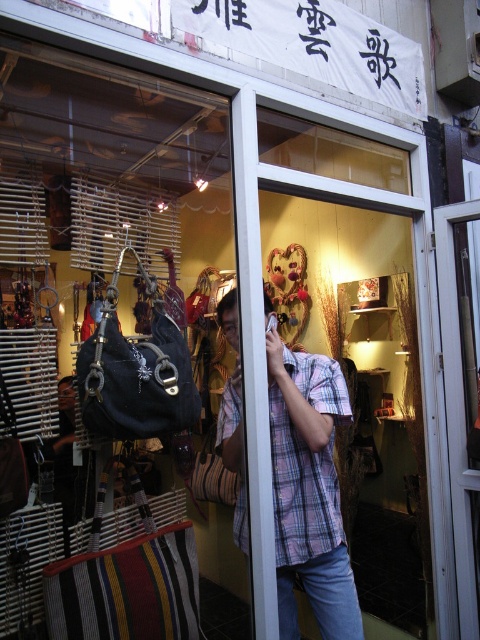
You are a customer entering the shop and want to see the items inside. Which object, the plaid cotton shirt at center or the transparent wood glass door at center, is blocking your view of the items behind it?

The plaid cotton shirt at center is bigger than the transparent wood glass door at center, so the plaid cotton shirt at center is blocking your view of the items behind it.